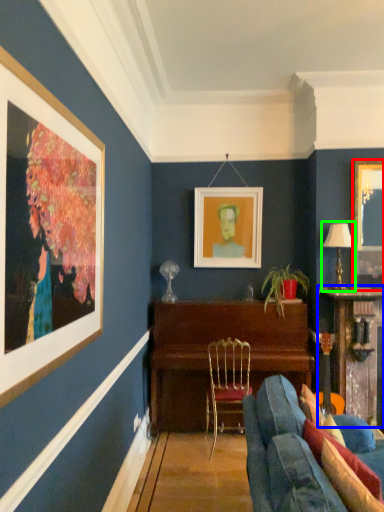
Question: Considering the real-world distances, which object is farthest from picture frame (highlighted by a red box)? table (highlighted by a blue box) or lamp (highlighted by a green box)?

Choices:
 (A) table
 (B) lamp

Answer: (A)